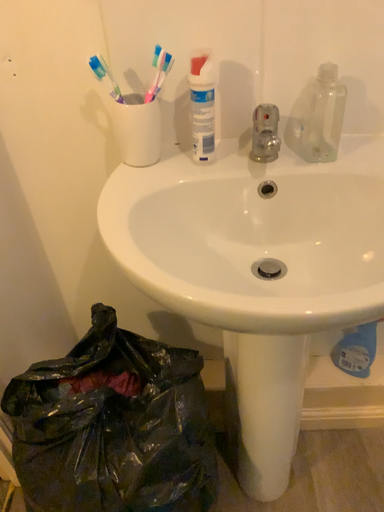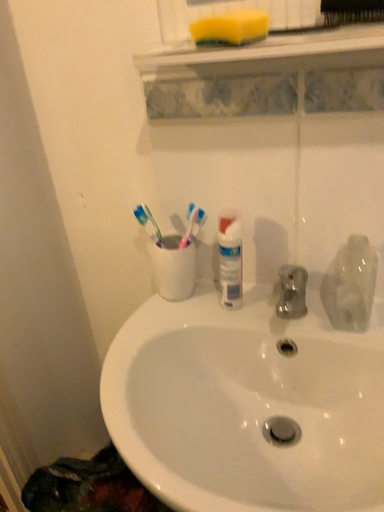
Question: Which way did the camera rotate in the video?

Choices:
 (A) rotated downward
 (B) rotated upward

Answer: (B)